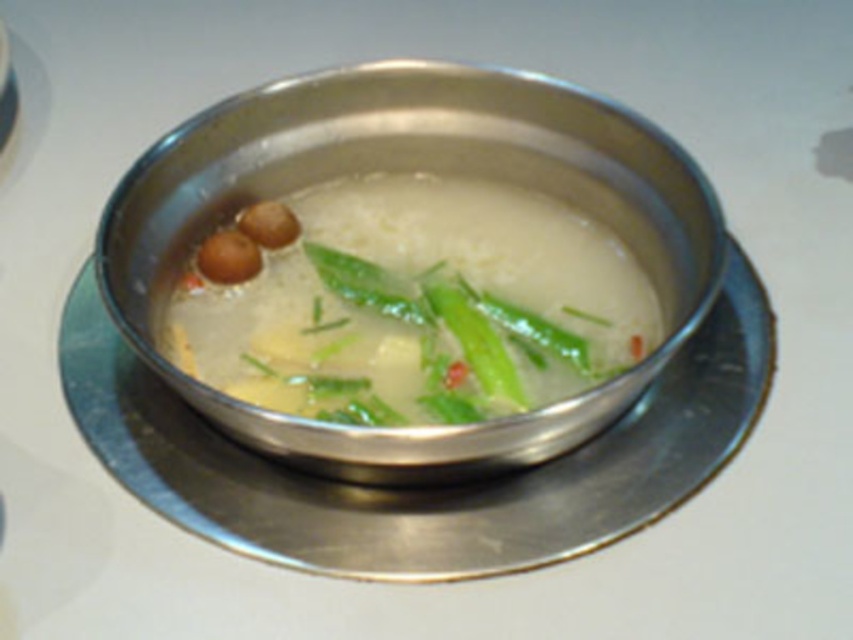
Who is higher up, satin silver bowl at center or green leafy vegetable at center?

satin silver bowl at center is higher up.

Who is positioned more to the right, satin silver bowl at center or green leafy vegetable at center?

Positioned to the right is green leafy vegetable at center.

Image resolution: width=853 pixels, height=640 pixels. I want to click on satin silver bowl at center, so click(412, 170).

The height and width of the screenshot is (640, 853). What are the coordinates of `satin silver bowl at center` in the screenshot? It's located at (412, 170).